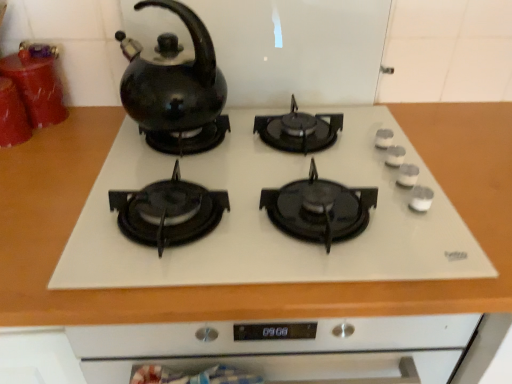
Question: From the image's perspective, is white glossy gas stove at center positioned above or below black glossy kettle at upper left?

Choices:
 (A) below
 (B) above

Answer: (A)

Question: Would you say white glossy gas stove at center is inside or outside black glossy kettle at upper left?

Choices:
 (A) inside
 (B) outside

Answer: (B)

Question: Which is farther from the white glossy gas stove at center?

Choices:
 (A) shiny red glass cups at left, the second kitchen appliance positioned from the front
 (B) black glossy kettle at upper left
 (C) matte red canister at left, which appears as the 1th kitchen appliance when viewed from the front

Answer: (C)

Question: Estimate the real-world distances between objects in this image. Which object is farther from the matte red canister at left, the second kitchen appliance viewed from the back?

Choices:
 (A) shiny red glass cups at left, which is counted as the 1th kitchen appliance, starting from the back
 (B) black glossy kettle at upper left
 (C) white glossy gas stove at center

Answer: (C)